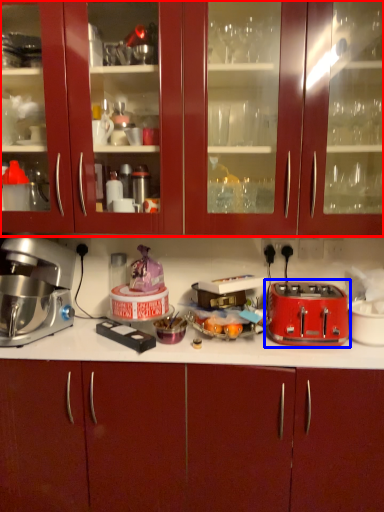
Question: Which point is closer to the camera, cabinetry (highlighted by a red box) or toaster (highlighted by a blue box)?

Choices:
 (A) cabinetry
 (B) toaster

Answer: (A)